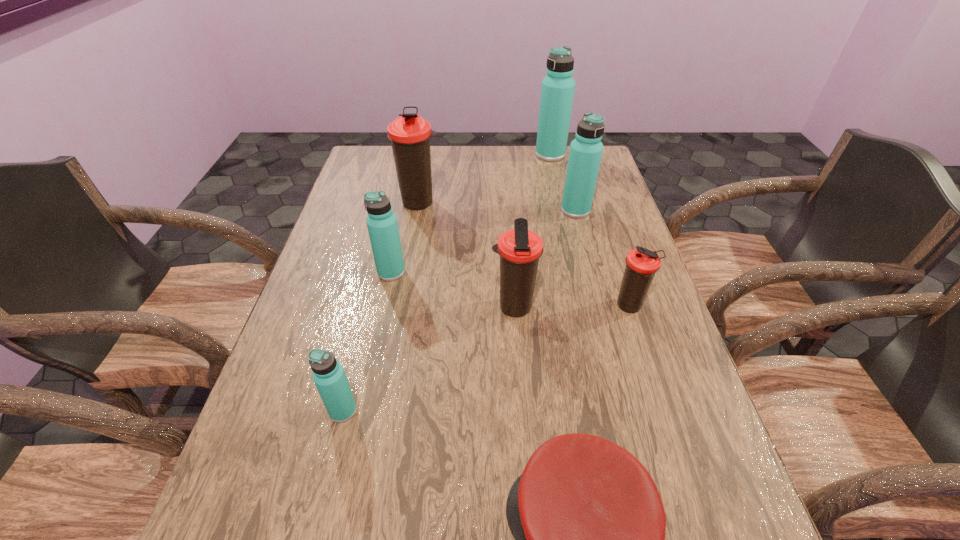
In order to click on vacant space that satisfies the following two spatial constraints: 1. on the back side of the third smallest aqua thermos bottle; 2. on the right side of the third biggest aqua thermos bottle in this screenshot , I will do `click(404, 210)`.